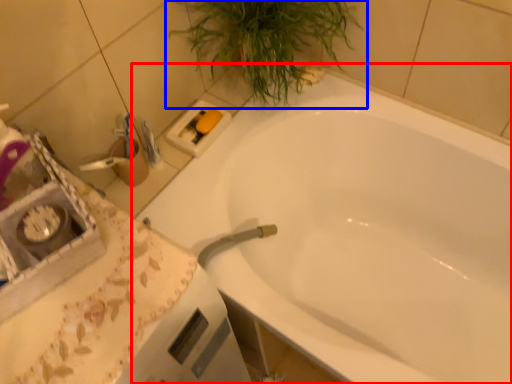
Question: Which point is further to the camera, bathtub (highlighted by a red box) or houseplant (highlighted by a blue box)?

Choices:
 (A) bathtub
 (B) houseplant

Answer: (B)